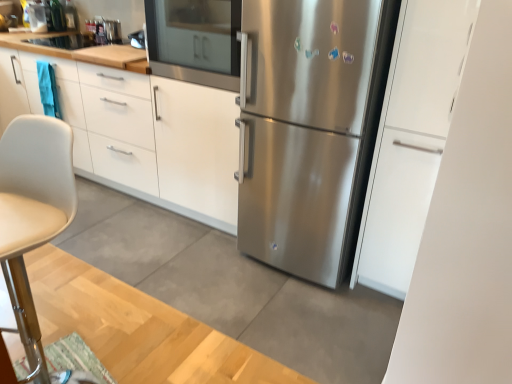
Question: Considering the positions of beige leather chair at left and stainless steel refrigerator at center in the image, is beige leather chair at left wider or thinner than stainless steel refrigerator at center?

Choices:
 (A) wide
 (B) thin

Answer: (B)

Question: From a real-world perspective, is beige leather chair at left above or below stainless steel refrigerator at center?

Choices:
 (A) above
 (B) below

Answer: (B)

Question: Considering the real-world distances, which object is closest to the beige leather chair at left?

Choices:
 (A) white matte cabinet at upper left, which ranks as the 1th cabinetry in left-to-right order
 (B) stainless steel refrigerator at center
 (C) satin white cabinet at right, acting as the first cabinetry starting from the front
 (D) stainless steel oven at center

Answer: (B)

Question: Which object is positioned farthest from the beige leather chair at left?

Choices:
 (A) white matte cabinet at upper left, positioned as the 2th cabinetry in front-to-back order
 (B) satin white cabinet at right, which is the second cabinetry in left-to-right order
 (C) stainless steel oven at center
 (D) stainless steel refrigerator at center

Answer: (A)